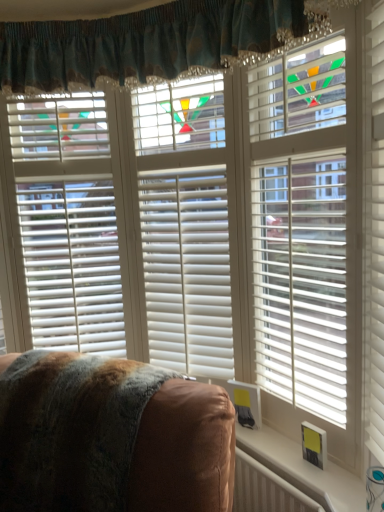
Question: From the image's perspective, would you say white plastic radiator at lower right is positioned over white matte blinds at right, which is counted as the 1th blind, starting from the right?

Choices:
 (A) no
 (B) yes

Answer: (A)

Question: Is white plastic radiator at lower right beside white matte blinds at right, which is counted as the 1th blind, starting from the right?

Choices:
 (A) no
 (B) yes

Answer: (A)

Question: Considering the relative sizes of white plastic radiator at lower right and white matte blinds at right, which is counted as the 1th blind, starting from the right, in the image provided, is white plastic radiator at lower right shorter than white matte blinds at right, which is counted as the 1th blind, starting from the right,?

Choices:
 (A) no
 (B) yes

Answer: (B)

Question: Considering the relative sizes of white plastic radiator at lower right and white matte blinds at right, which is counted as the 1th blind, starting from the right, in the image provided, is white plastic radiator at lower right thinner than white matte blinds at right, which is counted as the 1th blind, starting from the right,?

Choices:
 (A) no
 (B) yes

Answer: (B)

Question: From a real-world perspective, is white plastic radiator at lower right over white matte blinds at right, which is counted as the 1th blind, starting from the right?

Choices:
 (A) yes
 (B) no

Answer: (B)

Question: Could you tell me if white plastic radiator at lower right is turned towards white matte blinds at right, which is counted as the 1th blind, starting from the right?

Choices:
 (A) no
 (B) yes

Answer: (A)

Question: Is teal fabric curtain at upper center not inside brown leather chair at lower left?

Choices:
 (A) yes
 (B) no

Answer: (A)

Question: Does teal fabric curtain at upper center appear on the right side of brown leather chair at lower left?

Choices:
 (A) yes
 (B) no

Answer: (B)

Question: Does teal fabric curtain at upper center turn towards brown leather chair at lower left?

Choices:
 (A) yes
 (B) no

Answer: (B)

Question: Is teal fabric curtain at upper center oriented away from brown leather chair at lower left?

Choices:
 (A) no
 (B) yes

Answer: (A)

Question: Is teal fabric curtain at upper center at the left side of brown leather chair at lower left?

Choices:
 (A) yes
 (B) no

Answer: (A)

Question: From a real-world perspective, is teal fabric curtain at upper center over brown leather chair at lower left?

Choices:
 (A) yes
 (B) no

Answer: (A)

Question: Is white matte blinds at right, which is counted as the 1th blind, starting from the right, far away from white plastic radiator at lower right?

Choices:
 (A) no
 (B) yes

Answer: (A)